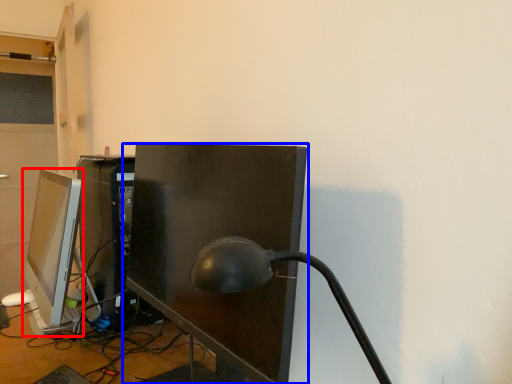
Question: Which point is further to the camera, computer monitor (highlighted by a red box) or computer monitor (highlighted by a blue box)?

Choices:
 (A) computer monitor
 (B) computer monitor

Answer: (A)